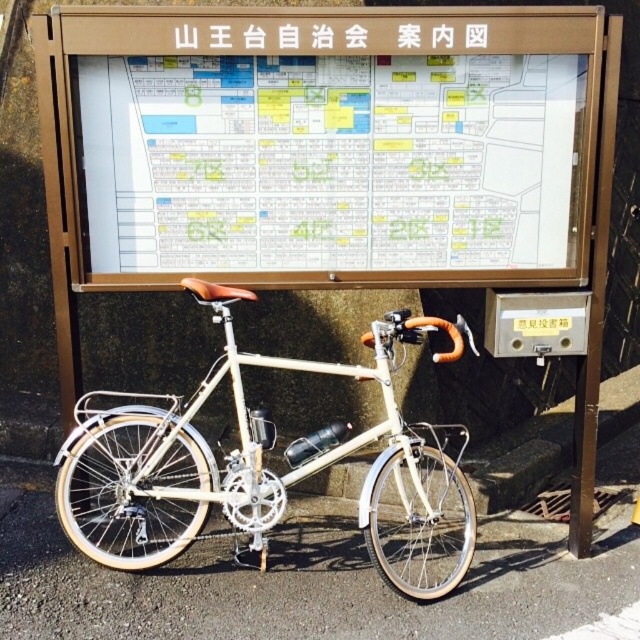
Question: Which point is farther to the camera?

Choices:
 (A) matte cream bicycle at center
 (B) white plastic sign at upper center
 (C) wooden signboard at upper center

Answer: (B)

Question: Does matte cream bicycle at center have a larger size compared to white plastic sign at upper center?

Choices:
 (A) yes
 (B) no

Answer: (A)

Question: Which of the following is the closest to the observer?

Choices:
 (A) (385, 340)
 (B) (445, 29)

Answer: (B)

Question: Can you confirm if wooden signboard at upper center is smaller than white plastic sign at upper center?

Choices:
 (A) yes
 (B) no

Answer: (B)

Question: Does wooden signboard at upper center appear on the right side of white plastic sign at upper center?

Choices:
 (A) no
 (B) yes

Answer: (A)

Question: Estimate the real-world distances between objects in this image. Which object is farther from the matte cream bicycle at center?

Choices:
 (A) wooden signboard at upper center
 (B) white plastic sign at upper center

Answer: (B)